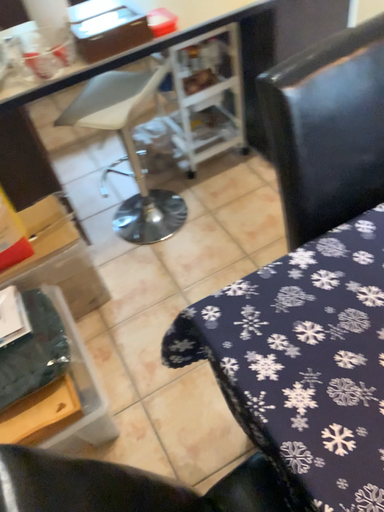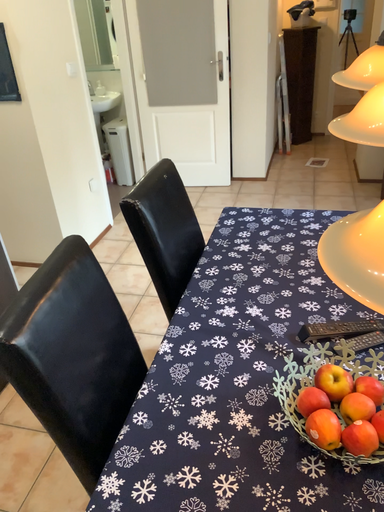
Question: Which way did the camera rotate in the video?

Choices:
 (A) rotated right
 (B) rotated left

Answer: (A)